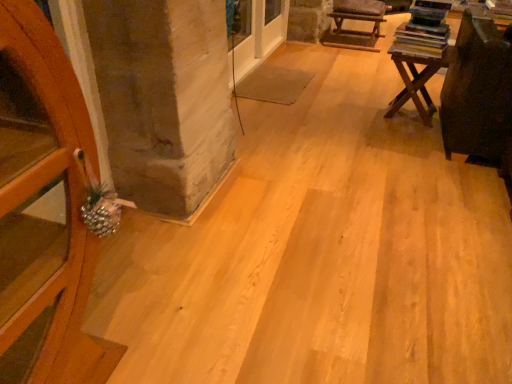
Question: Relative to brown leather armchair at upper right, is wooden table at right in front or behind?

Choices:
 (A) front
 (B) behind

Answer: (A)

Question: Considering the positions of wooden table at right and brown leather armchair at upper right in the image, is wooden table at right bigger or smaller than brown leather armchair at upper right?

Choices:
 (A) small
 (B) big

Answer: (A)

Question: From a real-world perspective, relative to brown leather armchair at upper right, is wooden table at right vertically above or below?

Choices:
 (A) below
 (B) above

Answer: (B)

Question: From a real-world perspective, is brown leather armchair at upper right above or below wooden table at right?

Choices:
 (A) below
 (B) above

Answer: (A)

Question: Is brown leather armchair at upper right wider or thinner than wooden table at right?

Choices:
 (A) wide
 (B) thin

Answer: (A)

Question: From the image's perspective, is brown leather armchair at upper right above or below wooden table at right?

Choices:
 (A) below
 (B) above

Answer: (B)

Question: Is brown leather armchair at upper right to the left or to the right of wooden table at right in the image?

Choices:
 (A) left
 (B) right

Answer: (A)